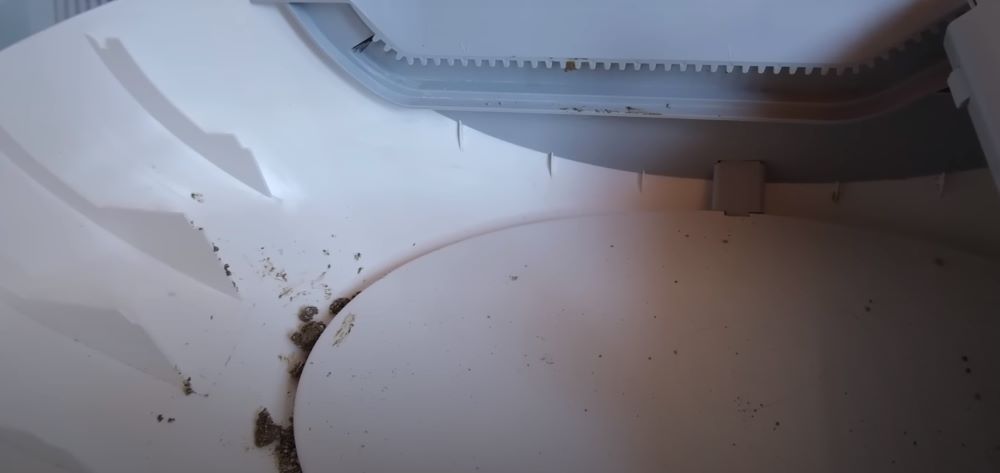
Locate an element on the screen. furthest white divider on left is located at coordinates (212, 149).